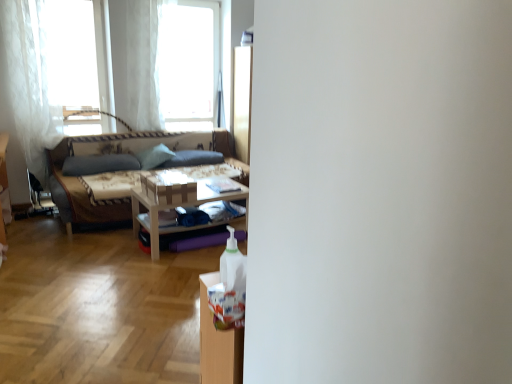
Question: Is textured beige fabric couch at left inside or outside of wooden table at center?

Choices:
 (A) outside
 (B) inside

Answer: (A)

Question: Is textured beige fabric couch at left taller or shorter than wooden table at center?

Choices:
 (A) short
 (B) tall

Answer: (B)

Question: Which of these objects is positioned farthest from the wooden table at center?

Choices:
 (A) green fabric pillow at center, which ranks as the 2th pillow in left-to-right order
 (B) dark gray fabric pillow at center, which is the 1th pillow from right to left
 (C) white sheer curtain at left, the second curtain viewed from the right
 (D) matte gray pillow at center, the 1th pillow positioned from the left
 (E) white sheer curtain at upper left, which appears as the second curtain when viewed from the left

Answer: (C)

Question: Which object is positioned closest to the white sheer curtain at left, the 1th curtain positioned from the left?

Choices:
 (A) wooden table at center
 (B) white sheer curtain at upper left, the 1th curtain positioned from the right
 (C) dark gray fabric pillow at center, which is the 1th pillow from right to left
 (D) transparent glass window at upper center, arranged as the second window when viewed from the left
 (E) textured beige fabric couch at left

Answer: (E)